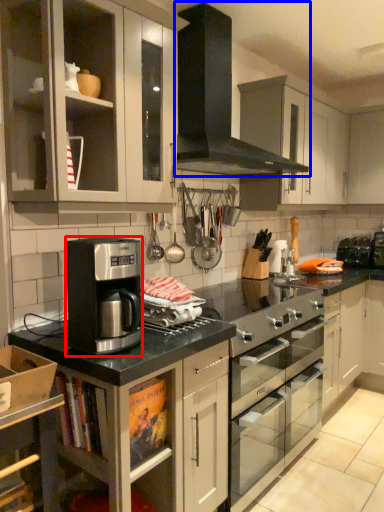
Question: Which of the following is the closest to the observer, kitchen appliance (highlighted by a red box) or gas stove (highlighted by a blue box)?

Choices:
 (A) kitchen appliance
 (B) gas stove

Answer: (A)